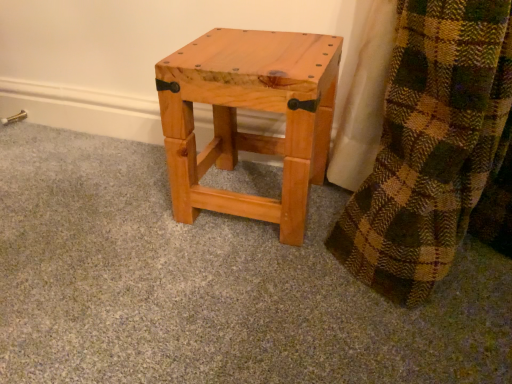
At what (x,y) coordinates should I click in order to perform the action: click on space that is in front of natural wood stool at center. Please return your answer as a coordinate pair (x, y). Looking at the image, I should click on (249, 274).